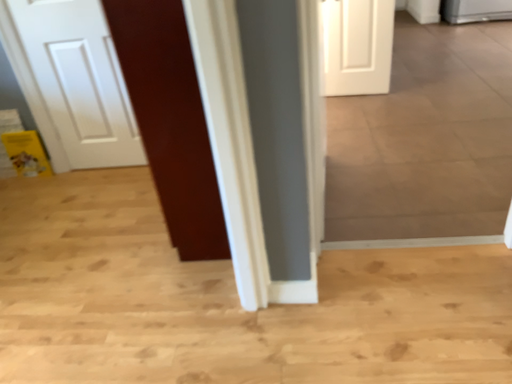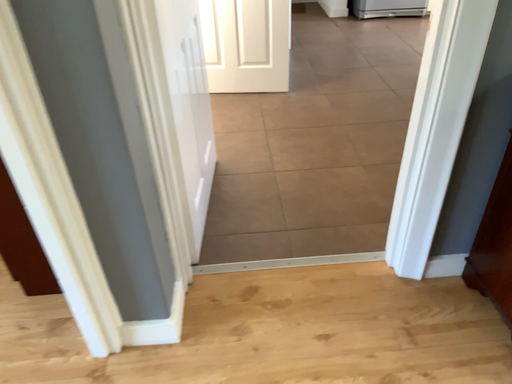
Question: How did the camera likely rotate when shooting the video?

Choices:
 (A) rotated left
 (B) rotated right

Answer: (B)